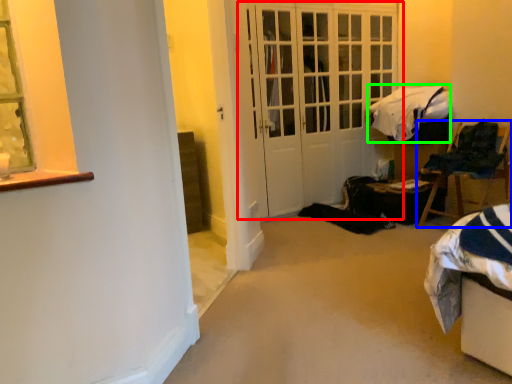
Question: Considering the real-world distances, which object is closest to door (highlighted by a red box)? chair (highlighted by a blue box) or blanket (highlighted by a green box).

Choices:
 (A) chair
 (B) blanket

Answer: (B)